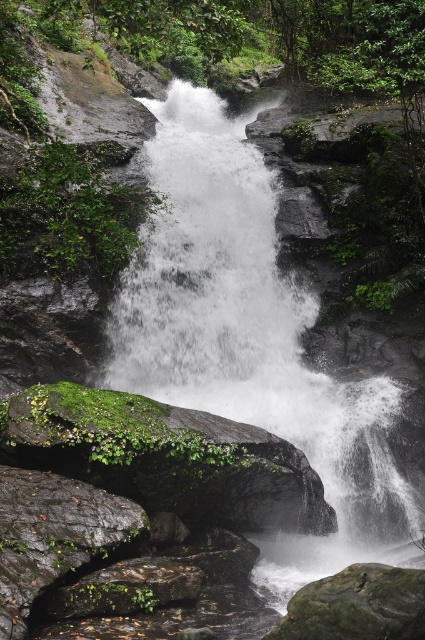
Question: Where is white frothy water at center located in relation to smooth gray rock at lower center in the image?

Choices:
 (A) above
 (B) below

Answer: (A)

Question: Among these points, which one is farthest from the camera?

Choices:
 (A) (167, 339)
 (B) (402, 577)

Answer: (A)

Question: Where is white frothy water at center located in relation to smooth gray rock at lower center in the image?

Choices:
 (A) above
 (B) below

Answer: (A)

Question: Can you confirm if white frothy water at center is positioned above smooth gray rock at lower center?

Choices:
 (A) yes
 (B) no

Answer: (A)